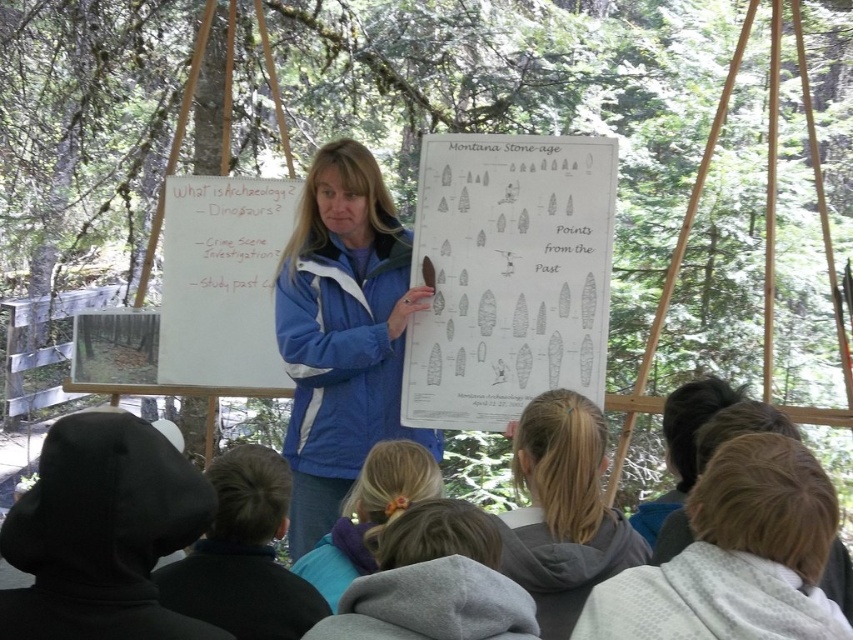
Question: Is light brown hair at lower right above blonde hair at center?

Choices:
 (A) yes
 (B) no

Answer: (B)

Question: Is blonde hair at center behind light blue hoodie at lower center?

Choices:
 (A) yes
 (B) no

Answer: (B)

Question: Where is whiteboard at upper left located in relation to light blue hoodie at lower center in the image?

Choices:
 (A) right
 (B) left

Answer: (B)

Question: Among these points, which one is farthest from the camera?

Choices:
 (A) (213, 192)
 (B) (650, 582)

Answer: (A)

Question: Among these objects, which one is farthest from the camera?

Choices:
 (A) light blue hoodie at lower center
 (B) whiteboard at upper left
 (C) blue fabric jacket at center
 (D) blonde hair at center

Answer: (B)

Question: Which of the following is the farthest from the observer?

Choices:
 (A) light brown hair at lower right
 (B) blue fabric jacket at center

Answer: (B)